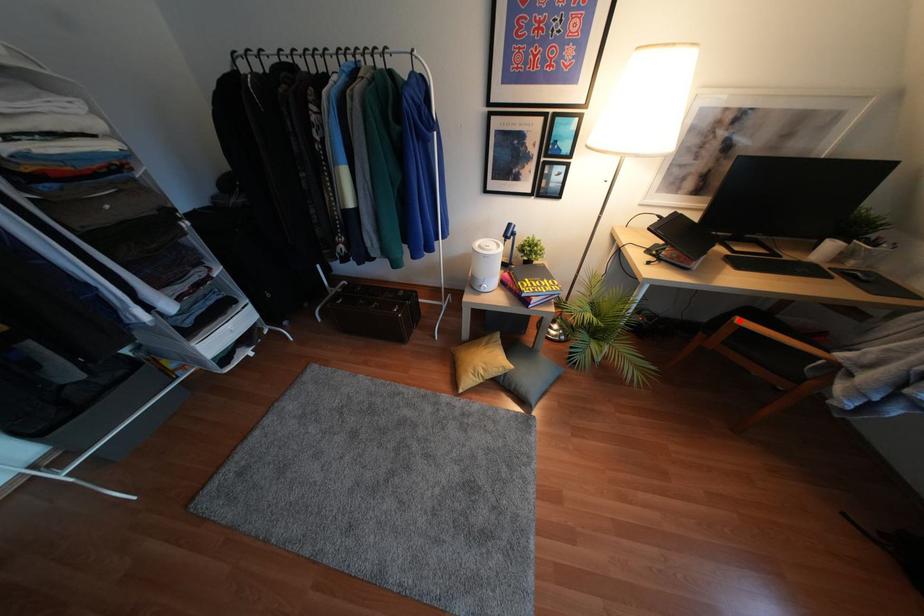
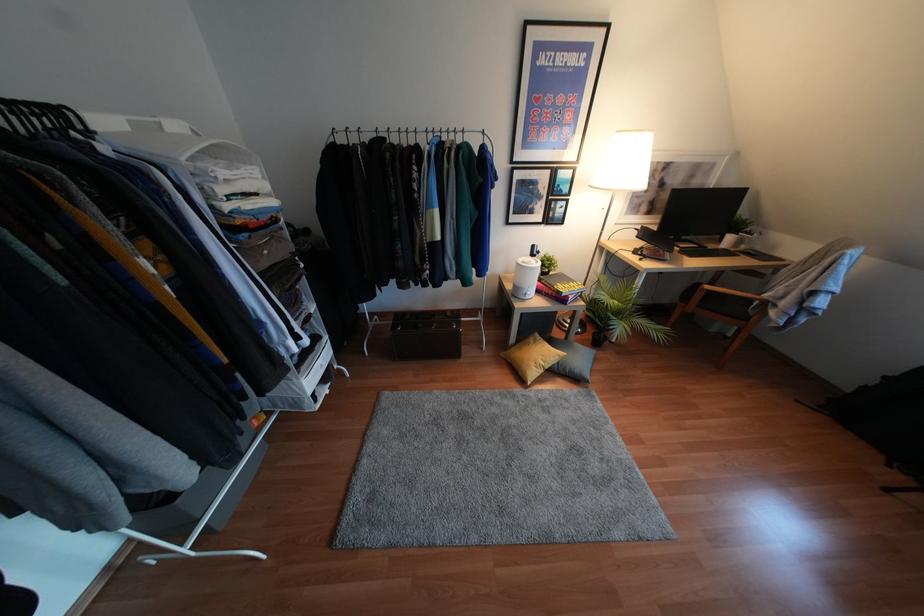
Question: I am providing you with two images of the same scene from different viewpoints. Given a red point in image1, look at the same physical point in image2. Is it:

Choices:
 (A) Closer to the viewpoint
 (B) Farther from the viewpoint

Answer: (A)